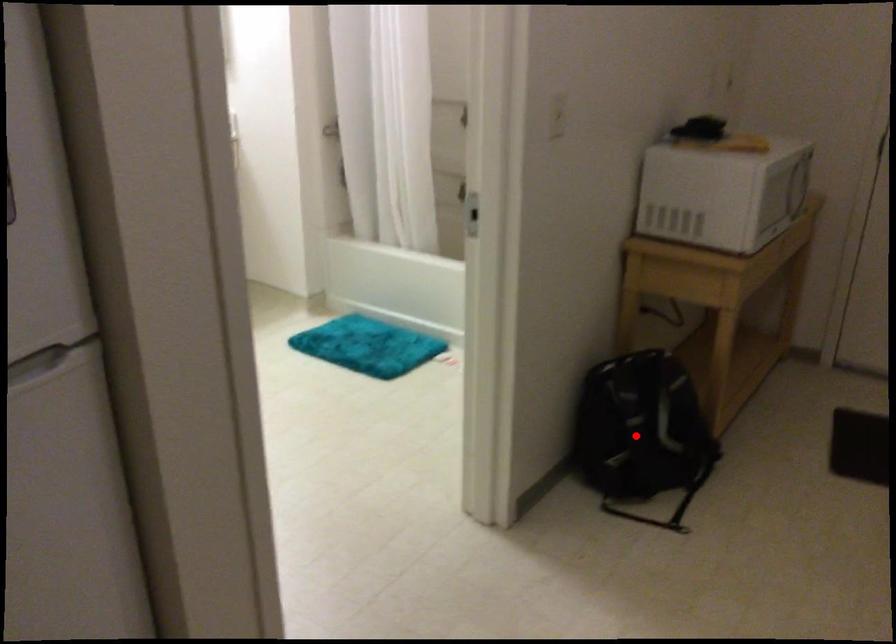
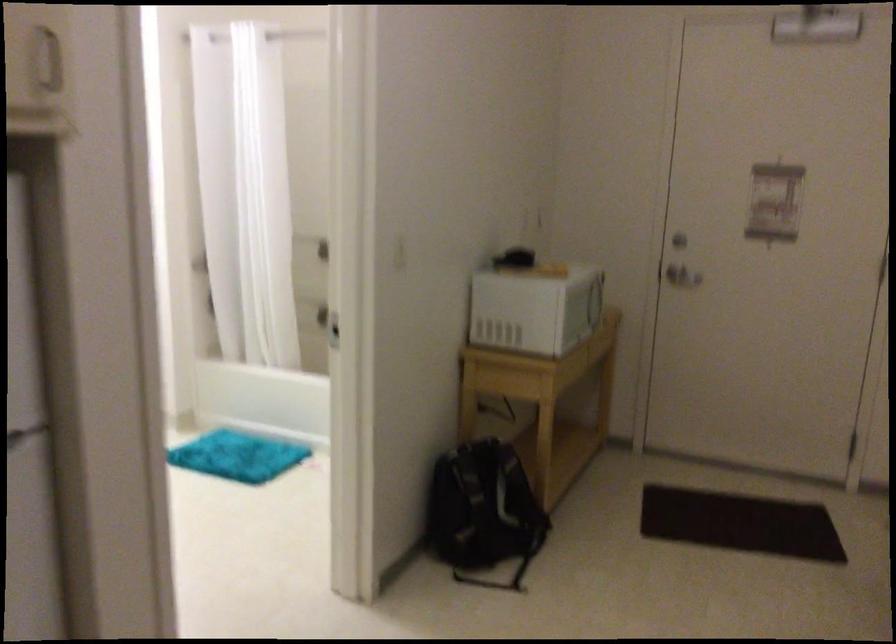
Where in the second image is the point corresponding to the highlighted location from the first image?

(483, 512)